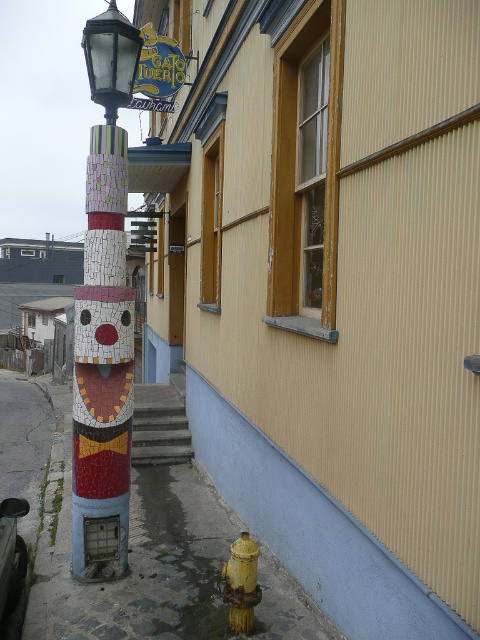
Question: Which of the following is the farthest from the observer?

Choices:
 (A) smooth concrete sidewalk at lower left
 (B) mosaic totem pole at left
 (C) matte glass street light at upper left
 (D) yellow matte hydrant at lower right

Answer: (C)

Question: Considering the relative positions of smooth concrete sidewalk at lower left and yellow matte hydrant at lower right in the image provided, where is smooth concrete sidewalk at lower left located with respect to yellow matte hydrant at lower right?

Choices:
 (A) above
 (B) below

Answer: (B)

Question: Among these points, which one is nearest to the camera?

Choices:
 (A) (204, 563)
 (B) (237, 588)

Answer: (B)

Question: Which of the following is the farthest from the observer?

Choices:
 (A) mosaic totem pole at left
 (B) yellow matte hydrant at lower right

Answer: (A)

Question: Is smooth concrete sidewalk at lower left behind mosaic totem pole at left?

Choices:
 (A) no
 (B) yes

Answer: (A)

Question: Can you confirm if matte glass street light at upper left is positioned below yellow matte hydrant at lower right?

Choices:
 (A) yes
 (B) no

Answer: (B)